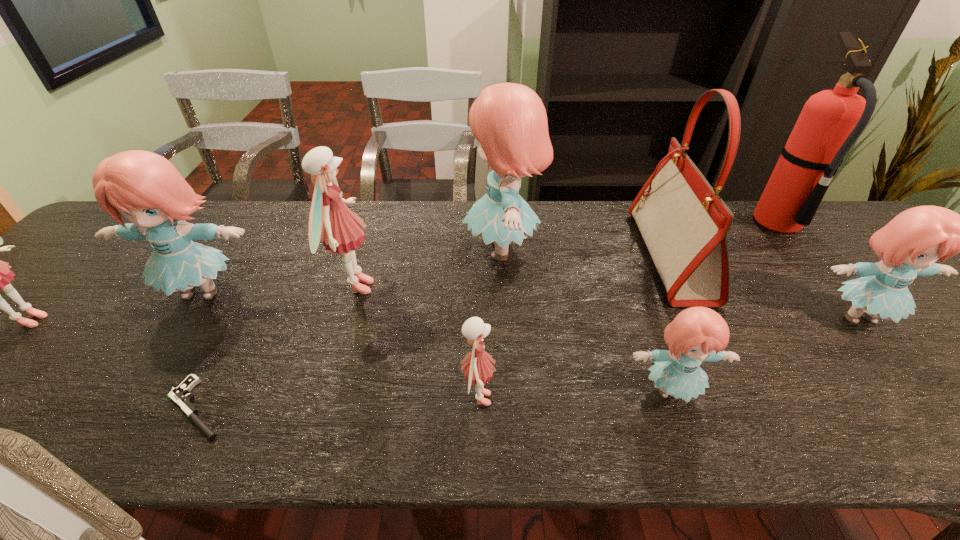
Find the location of a particular element. The width and height of the screenshot is (960, 540). vacant space situated on the front-facing side of the second blue doll from left to right is located at coordinates (401, 250).

Locate an element on the screen. The image size is (960, 540). free region located 0.050m on the front-facing side of the second blue doll from left to right is located at coordinates (444, 250).

I want to click on vacant space situated 0.050m on the front of the handbag, so click(x=704, y=325).

Identify the location of vacant space located 0.350m on the front-facing side of the biggest pink doll. The image size is (960, 540). (516, 287).

Identify the location of free region located 0.230m on the front-facing side of the leftmost blue doll. The image size is (960, 540). (124, 407).

Locate an element on the screen. The image size is (960, 540). vacant space situated on the front-facing side of the rightmost blue doll is located at coordinates (899, 364).

Identify the location of free space located on the front-facing side of the nearest pink doll. (671, 399).

This screenshot has width=960, height=540. I want to click on vacant space positioned on the front-facing side of the third blue doll from left to right, so click(689, 441).

Find the location of a particular element. The image size is (960, 540). free space located 0.160m on the front-facing side of the shortest object is located at coordinates (82, 408).

This screenshot has width=960, height=540. What are the coordinates of `blank space located on the front-facing side of the shortest object` in the screenshot? It's located at (97, 408).